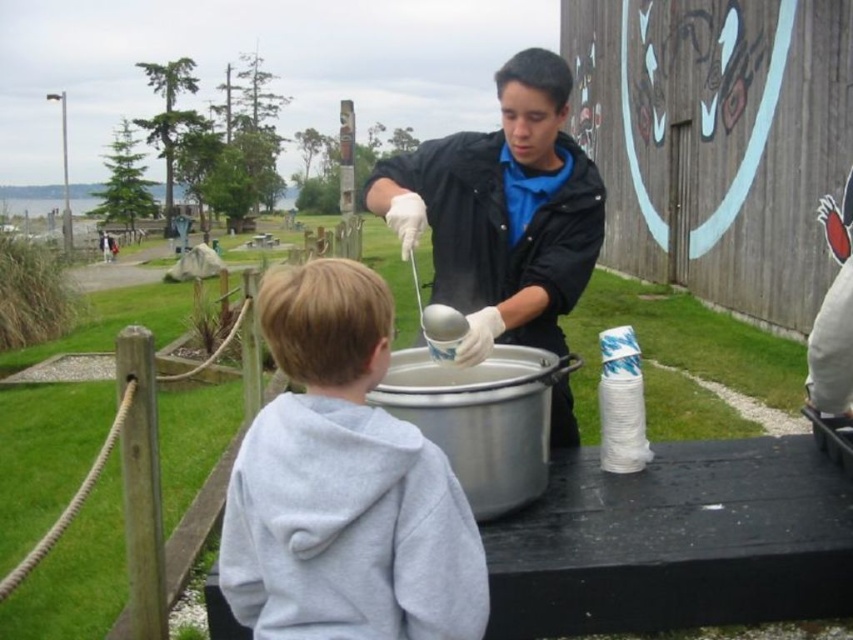
From the picture: Does gray fleece hoodie at lower left have a larger size compared to white glossy bowl at center?

Indeed, gray fleece hoodie at lower left has a larger size compared to white glossy bowl at center.

Between point (289, 403) and point (413, 177), which one is positioned behind?

Point (413, 177)

Between point (351, 618) and point (467, 250), which one is positioned in front?

Point (351, 618)

Locate an element on the screen. This screenshot has height=640, width=853. gray fleece hoodie at lower left is located at coordinates [343, 484].